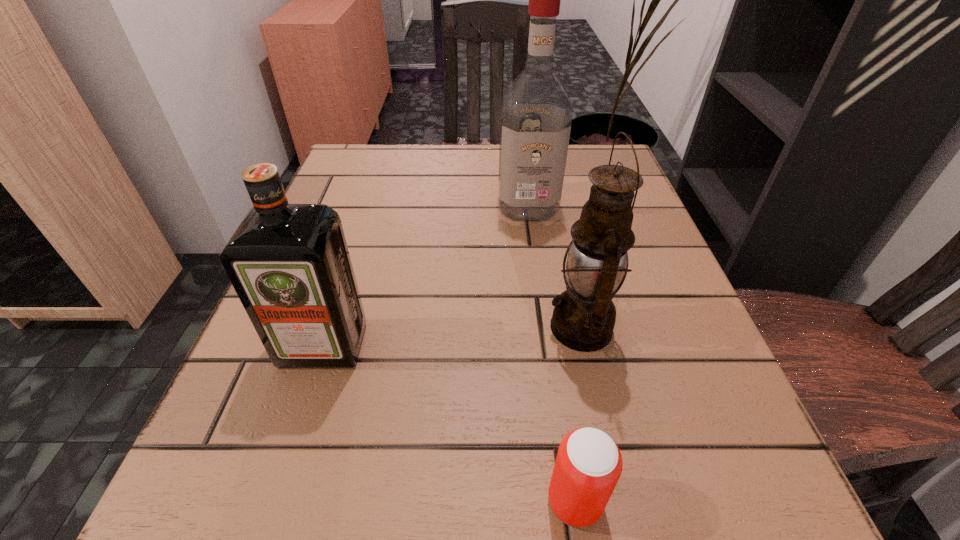
The width and height of the screenshot is (960, 540). I want to click on blank area in the image that satisfies the following two spatial constraints: 1. on the front-facing side of the beer can; 2. on the left side of the farther liquor, so click(568, 501).

Where is `free space that satisfies the following two spatial constraints: 1. on the front-facing side of the oil lamp; 2. on the right side of the tallest object`? The image size is (960, 540). free space that satisfies the following two spatial constraints: 1. on the front-facing side of the oil lamp; 2. on the right side of the tallest object is located at coordinates (544, 327).